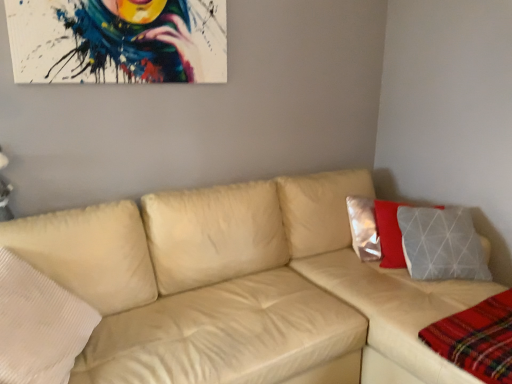
Question: Is the position of plaid fabric at lower right more distant than that of beige leather couch at center?

Choices:
 (A) yes
 (B) no

Answer: (A)

Question: Considering the relative sizes of plaid fabric at lower right and beige leather couch at center in the image provided, is plaid fabric at lower right wider than beige leather couch at center?

Choices:
 (A) no
 (B) yes

Answer: (A)

Question: Does plaid fabric at lower right have a lesser width compared to beige leather couch at center?

Choices:
 (A) yes
 (B) no

Answer: (A)

Question: Does plaid fabric at lower right have a smaller size compared to beige leather couch at center?

Choices:
 (A) yes
 (B) no

Answer: (A)

Question: From a real-world perspective, is plaid fabric at lower right physically below beige leather couch at center?

Choices:
 (A) yes
 (B) no

Answer: (B)

Question: Can you confirm if plaid fabric at lower right is positioned to the right of beige leather couch at center?

Choices:
 (A) no
 (B) yes

Answer: (B)

Question: From the image's perspective, is beige leather couch at center beneath plaid fabric at lower right?

Choices:
 (A) no
 (B) yes

Answer: (A)

Question: Is the surface of beige leather couch at center in direct contact with plaid fabric at lower right?

Choices:
 (A) no
 (B) yes

Answer: (A)

Question: Is beige leather couch at center looking in the opposite direction of plaid fabric at lower right?

Choices:
 (A) no
 (B) yes

Answer: (A)

Question: Is beige leather couch at center aimed at plaid fabric at lower right?

Choices:
 (A) yes
 (B) no

Answer: (A)

Question: Can you confirm if beige leather couch at center is positioned to the right of plaid fabric at lower right?

Choices:
 (A) yes
 (B) no

Answer: (B)

Question: Considering the relative sizes of beige leather couch at center and plaid fabric at lower right in the image provided, is beige leather couch at center thinner than plaid fabric at lower right?

Choices:
 (A) yes
 (B) no

Answer: (B)

Question: From the image's perspective, is plaid fabric at lower right above or below beige leather couch at center?

Choices:
 (A) above
 (B) below

Answer: (B)